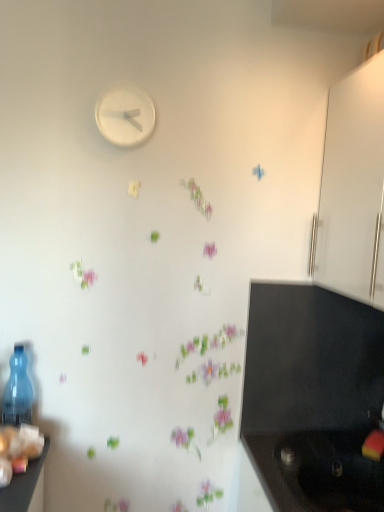
Question: Can you confirm if white glossy cabinet at right is taller than white matte clock at upper center?

Choices:
 (A) no
 (B) yes

Answer: (B)

Question: Can you confirm if white glossy cabinet at right is smaller than white matte clock at upper center?

Choices:
 (A) yes
 (B) no

Answer: (B)

Question: From the image's perspective, is white glossy cabinet at right above white matte clock at upper center?

Choices:
 (A) yes
 (B) no

Answer: (B)

Question: Is white glossy cabinet at right at the left side of white matte clock at upper center?

Choices:
 (A) no
 (B) yes

Answer: (A)

Question: Is the position of white glossy cabinet at right less distant than that of white matte clock at upper center?

Choices:
 (A) no
 (B) yes

Answer: (B)

Question: Is white glossy cabinet at right bigger than white matte clock at upper center?

Choices:
 (A) no
 (B) yes

Answer: (B)

Question: Does transparent plastic bottle at left have a lesser height compared to white glossy cabinet at right?

Choices:
 (A) no
 (B) yes

Answer: (B)

Question: From the image's perspective, is transparent plastic bottle at left located beneath white glossy cabinet at right?

Choices:
 (A) no
 (B) yes

Answer: (B)

Question: Does transparent plastic bottle at left have a greater height compared to white glossy cabinet at right?

Choices:
 (A) yes
 (B) no

Answer: (B)

Question: From a real-world perspective, is transparent plastic bottle at left positioned over white glossy cabinet at right based on gravity?

Choices:
 (A) no
 (B) yes

Answer: (A)

Question: Can white glossy cabinet at right be found inside transparent plastic bottle at left?

Choices:
 (A) no
 (B) yes

Answer: (A)

Question: Is transparent plastic bottle at left to the left of white glossy cabinet at right from the viewer's perspective?

Choices:
 (A) yes
 (B) no

Answer: (A)

Question: Does transparent plastic bottle at left have a lesser width compared to black matte sink at lower right?

Choices:
 (A) no
 (B) yes

Answer: (B)